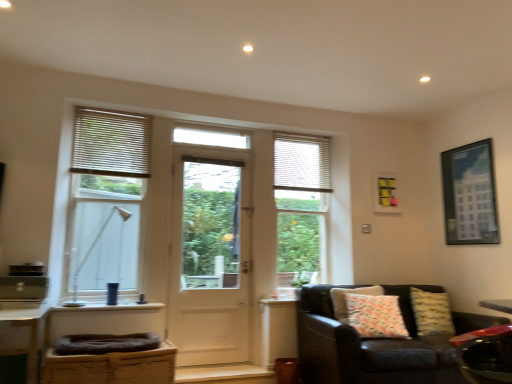
This screenshot has width=512, height=384. I want to click on patterned fabric pillow at lower right, which is the first pillow in left-to-right order, so click(x=345, y=299).

The image size is (512, 384). Describe the element at coordinates (301, 206) in the screenshot. I see `matte white window at center, which appears as the first window when viewed from the back` at that location.

Locate an element on the screen. The width and height of the screenshot is (512, 384). white matte blinds at upper left is located at coordinates pos(111,143).

Is clear glass window at left, positioned as the first window in front-to-back order, situated inside matte white window at center, placed as the third window when sorted from left to right, or outside?

clear glass window at left, positioned as the first window in front-to-back order, is not enclosed by matte white window at center, placed as the third window when sorted from left to right.

From a real-world perspective, is clear glass window at left, which is the 2th window from left to right, located beneath matte white window at center, the 1th window viewed from the right?

Indeed, from a real-world perspective, clear glass window at left, which is the 2th window from left to right, is positioned beneath matte white window at center, the 1th window viewed from the right.

Does clear glass window at left, which is the 2th window from left to right, appear on the right side of matte white window at center, the 1th window viewed from the right?

In fact, clear glass window at left, which is the 2th window from left to right, is to the left of matte white window at center, the 1th window viewed from the right.

Is matte white window at center, which appears as the first window when viewed from the back, at the back of clear glass window at left, the 3th window positioned from the back?

No, clear glass window at left, the 3th window positioned from the back, is not facing away from matte white window at center, which appears as the first window when viewed from the back.

Looking at their sizes, would you say brown woven basket at lower left, the second swivel chair in the front-to-back sequence, is wider or thinner than matte white window at center, placed as the third window when sorted from left to right?

Clearly, brown woven basket at lower left, the second swivel chair in the front-to-back sequence, has more width compared to matte white window at center, placed as the third window when sorted from left to right.

Is point (165, 347) closer or farther from the camera than point (305, 177)?

Point (165, 347) is positioned closer to the camera compared to point (305, 177).

Could you tell me if brown woven basket at lower left, the 2th swivel chair when ordered from top to bottom, is turned towards matte white window at center, arranged as the third window when viewed from the front?

No, brown woven basket at lower left, the 2th swivel chair when ordered from top to bottom, is not aimed at matte white window at center, arranged as the third window when viewed from the front.

Consider the image. Can you confirm if brown woven basket at lower left, the second swivel chair in the right-to-left sequence, is taller than matte white window at center, placed as the third window when sorted from left to right?

No.

Between patterned fabric pillow at lower right, which is the first pillow in left-to-right order, and white matte blinds at upper left, which one has smaller width?

white matte blinds at upper left.

Based on the photo, from the image's perspective, between patterned fabric pillow at lower right, which is the first pillow in left-to-right order, and white matte blinds at upper left, which one is located above?

white matte blinds at upper left is shown above in the image.

Consider the image. From a real-world perspective, who is located lower, patterned fabric pillow at lower right, which is the first pillow in left-to-right order, or white matte blinds at upper left?

In real-world perspective, patterned fabric pillow at lower right, which is the first pillow in left-to-right order, is lower.

Is the position of patterned fabric pillow at lower right, which is the first pillow in left-to-right order, more distant than that of white matte blinds at upper left?

No, the depth of patterned fabric pillow at lower right, which is the first pillow in left-to-right order, is less than that of white matte blinds at upper left.

What's the angular difference between metallic red swivel chair at lower right, acting as the second swivel chair starting from the back, and brown woven basket at lower left, marked as the 1th swivel chair in a back-to-front arrangement,'s facing directions?

133 degrees separate the facing orientations of metallic red swivel chair at lower right, acting as the second swivel chair starting from the back, and brown woven basket at lower left, marked as the 1th swivel chair in a back-to-front arrangement.

Is metallic red swivel chair at lower right, which is counted as the second swivel chair, starting from the bottom, far away from brown woven basket at lower left, the second swivel chair in the right-to-left sequence?

Yes.

Considering the positions of point (476, 379) and point (140, 358), is point (476, 379) closer or farther from the camera than point (140, 358)?

Point (476, 379) is positioned farther from the camera compared to point (140, 358).

Can you confirm if wooden blinds at left, the 2th window viewed from the back, is shorter than patterned fabric pillow at lower right, which ranks as the 2th pillow in right-to-left order?

In fact, wooden blinds at left, the 2th window viewed from the back, may be taller than patterned fabric pillow at lower right, which ranks as the 2th pillow in right-to-left order.

From the image's perspective, which one is positioned lower, wooden blinds at left, which ranks as the 2th window in front-to-back order, or patterned fabric pillow at lower right, which is the first pillow in left-to-right order?

patterned fabric pillow at lower right, which is the first pillow in left-to-right order, appears lower in the image.

Which window is the 3rd one when counting from the left side of the patterned fabric pillow at lower right, which is the first pillow in left-to-right order? Please provide its 2D coordinates.

[(106, 198)]

Who is bigger, wooden blinds at left, the 2th window viewed from the back, or patterned fabric pillow at lower right, which ranks as the 2th pillow in right-to-left order?

wooden blinds at left, the 2th window viewed from the back, is bigger.

Which point is more forward, [216,273] or [339,300]?

Point [339,300]

From the picture: Based on their sizes in the image, would you say white wooden door at center is bigger or smaller than patterned fabric pillow at lower right, which ranks as the 2th pillow in right-to-left order?

white wooden door at center is bigger than patterned fabric pillow at lower right, which ranks as the 2th pillow in right-to-left order.

Relative to patterned fabric pillow at lower right, which ranks as the 2th pillow in right-to-left order, is white wooden door at center in front or behind?

Clearly, white wooden door at center is behind patterned fabric pillow at lower right, which ranks as the 2th pillow in right-to-left order.

Can you confirm if brown woven basket at lower left, the first swivel chair from the left, is shorter than leather couch at lower right?

Correct, brown woven basket at lower left, the first swivel chair from the left, is not as tall as leather couch at lower right.

From the leather couch at lower right, count 1st swivel chairs forward and point to it. Please provide its 2D coordinates.

[(112, 367)]

In the scene shown: Considering the relative sizes of brown woven basket at lower left, marked as the 1th swivel chair in a back-to-front arrangement, and leather couch at lower right in the image provided, is brown woven basket at lower left, marked as the 1th swivel chair in a back-to-front arrangement, smaller than leather couch at lower right?

Indeed, brown woven basket at lower left, marked as the 1th swivel chair in a back-to-front arrangement, has a smaller size compared to leather couch at lower right.

Is point (63, 375) closer or farther from the camera than point (370, 360)?

Point (63, 375) is closer to the camera than point (370, 360).

At what (x,y) coordinates should I click in order to perform the action: click on window below the matte white window at center, the 1th window viewed from the right (from the image's perspective). Please return your answer as a coordinate pair (x, y). This screenshot has height=384, width=512. Looking at the image, I should click on (105, 243).

Which window is the 3rd one when counting from the back of the brown woven basket at lower left, the first swivel chair from the left? Please provide its 2D coordinates.

[(301, 206)]

Estimate the real-world distances between objects in this image. Which object is further from yellow textured pillow at lower right, the first pillow positioned from the right, clear glass window at left, which is the 2th window from left to right, or metallic silver picture frame at upper right?

Among the two, clear glass window at left, which is the 2th window from left to right, is located further to yellow textured pillow at lower right, the first pillow positioned from the right.

From the image, which object appears to be farther from white wooden door at center, white matte blinds at upper left or brown woven basket at lower left, marked as the 1th swivel chair in a back-to-front arrangement?

Based on the image, brown woven basket at lower left, marked as the 1th swivel chair in a back-to-front arrangement, appears to be further to white wooden door at center.

Based on their spatial positions, is wooden blinds at left, the 1th window viewed from the left, or brown woven basket at lower left, arranged as the first swivel chair when ordered from the bottom, further from matte white window at center, the 1th window viewed from the right?

brown woven basket at lower left, arranged as the first swivel chair when ordered from the bottom, is further to matte white window at center, the 1th window viewed from the right.

Based on their spatial positions, is metallic silver picture frame at upper right or patterned fabric pillow at lower right, which ranks as the 2th pillow in right-to-left order, closer to white matte blinds at upper left?

patterned fabric pillow at lower right, which ranks as the 2th pillow in right-to-left order, is positioned closer to the anchor white matte blinds at upper left.

Estimate the real-world distances between objects in this image. Which object is further from patterned fabric pillow at lower right, which ranks as the 2th pillow in right-to-left order, metallic silver picture frame at upper right or white wooden door at center?

The object further to patterned fabric pillow at lower right, which ranks as the 2th pillow in right-to-left order, is white wooden door at center.

Which object lies further to the anchor point matte white window at center, arranged as the third window when viewed from the front, wooden blinds at left, the third window positioned from the right, or metallic silver picture frame at upper right?

wooden blinds at left, the third window positioned from the right, lies further to matte white window at center, arranged as the third window when viewed from the front, than the other object.

When comparing their distances from white matte shutter at upper right, does wooden blinds at left, the 2th window viewed from the back, or metallic red swivel chair at lower right, the 2th swivel chair viewed from the left, seem further?

Among the two, metallic red swivel chair at lower right, the 2th swivel chair viewed from the left, is located further to white matte shutter at upper right.

Looking at the image, which one is located further to white matte shutter at upper right, clear glass window at left, which is the 2th window from left to right, or white wooden door at center?

clear glass window at left, which is the 2th window from left to right, is further to white matte shutter at upper right.

The image size is (512, 384). In order to click on pillow positioned between metallic red swivel chair at lower right, the first swivel chair from the front, and yellow textured pillow at lower right, the 2th pillow when ordered from left to right, from near to far in this screenshot , I will do `click(345, 299)`.

Locate an element on the screen. The width and height of the screenshot is (512, 384). shutter located between white wooden door at center and patterned fabric pillow at lower right, which is the first pillow in left-to-right order, in the left-right direction is located at coordinates (301, 162).

Locate an element on the screen. The height and width of the screenshot is (384, 512). door situated between wooden blinds at left, the third window positioned from the right, and matte white window at center, arranged as the third window when viewed from the front, from left to right is located at coordinates (209, 257).

What are the coordinates of `window located between white matte blinds at upper left and leather couch at lower right in the left-right direction` in the screenshot? It's located at (301, 206).